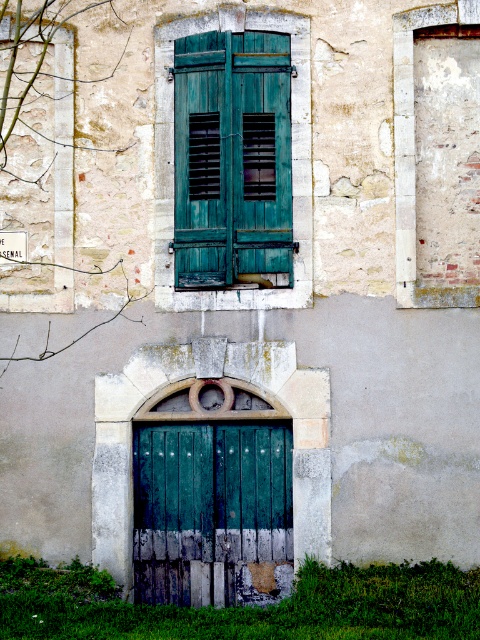
Is teal wood shutters at center taller than green wooden door at center?

Indeed, teal wood shutters at center has a greater height compared to green wooden door at center.

Between teal wood shutters at center and green wooden door at center, which one has less height?

green wooden door at center

Does point (194, 88) come farther from viewer compared to point (187, 604)?

That is True.

This screenshot has height=640, width=480. What are the coordinates of `teal wood shutters at center` in the screenshot? It's located at (231, 160).